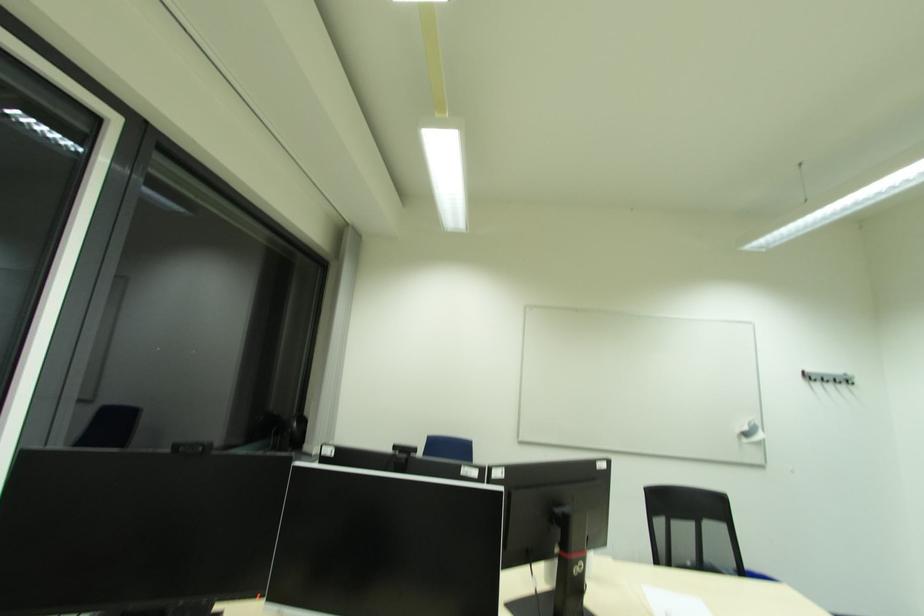
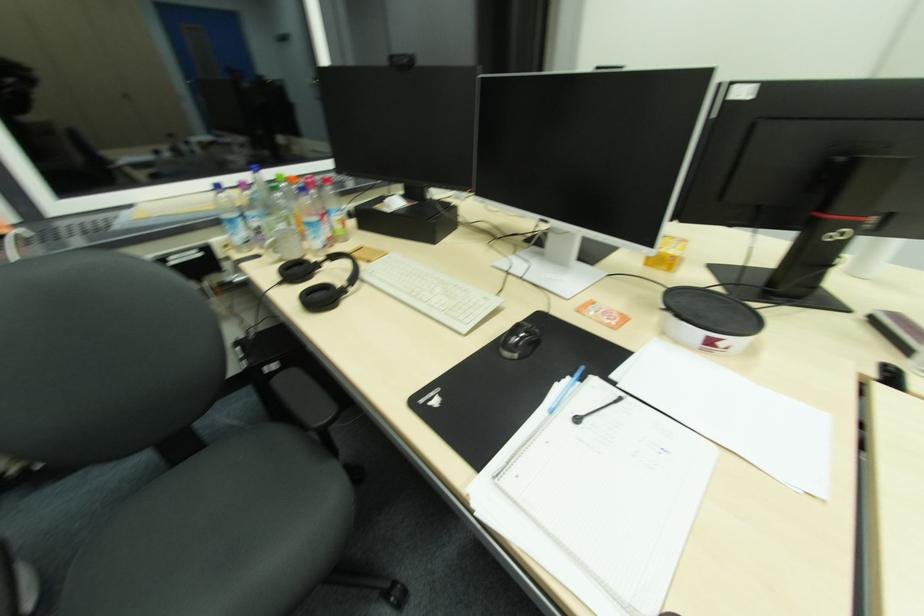
First-person continuous shooting, in which direction is the camera rotating?

The camera's rotation is toward left-down.